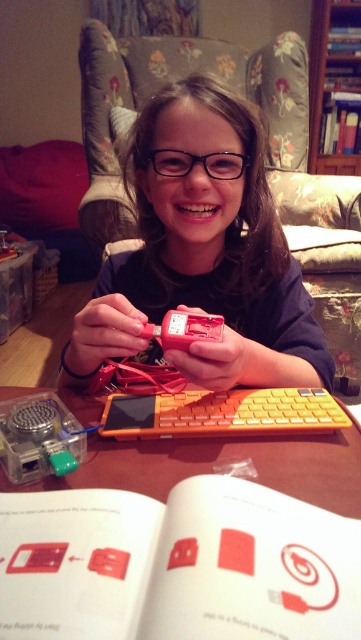
Question: Which point is farther from the camera taking this photo?

Choices:
 (A) (249, 161)
 (B) (114, 426)

Answer: (A)

Question: Does matte red toy at center come behind clear plastic speaker at center?

Choices:
 (A) no
 (B) yes

Answer: (B)

Question: Which object is farther from the camera taking this photo?

Choices:
 (A) clear plastic speaker at center
 (B) black plastic glasses at center
 (C) white paper book at center

Answer: (B)

Question: Which point is farther from the camera taking this photo?

Choices:
 (A) (219, 172)
 (B) (48, 426)
 (C) (50, 554)
 (D) (244, 362)

Answer: (A)

Question: Can you confirm if matte red toy at center is smaller than yellow matte keyboard at center?

Choices:
 (A) yes
 (B) no

Answer: (B)

Question: Is yellow matte keyboard at center behind black plastic glasses at center?

Choices:
 (A) yes
 (B) no

Answer: (B)